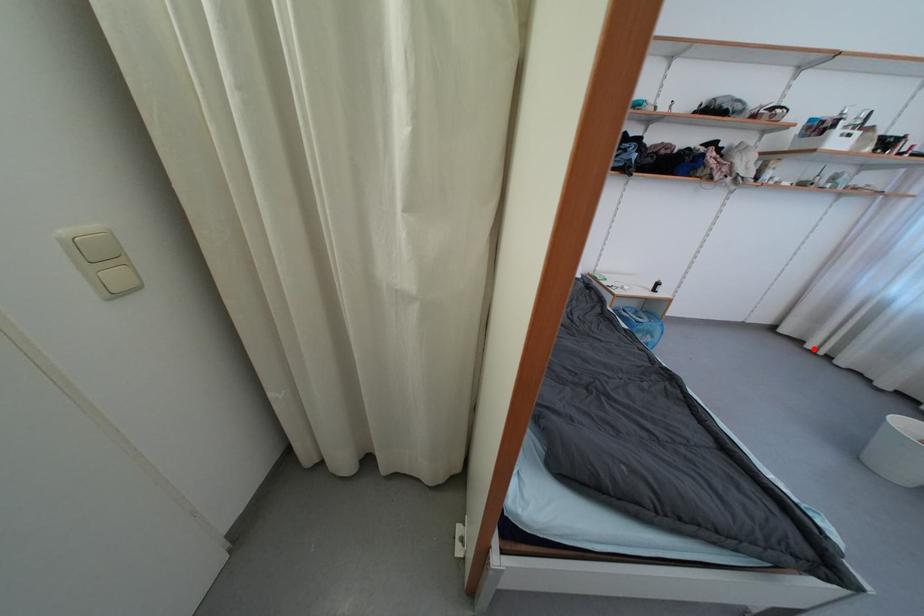
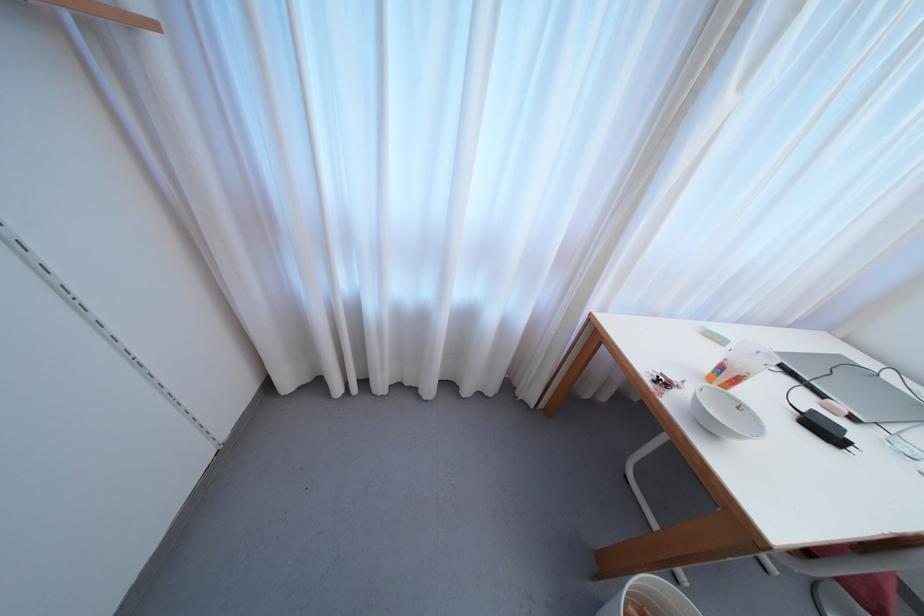
Locate, in the second image, the point that corresponds to the highlighted location in the first image.

(342, 392)